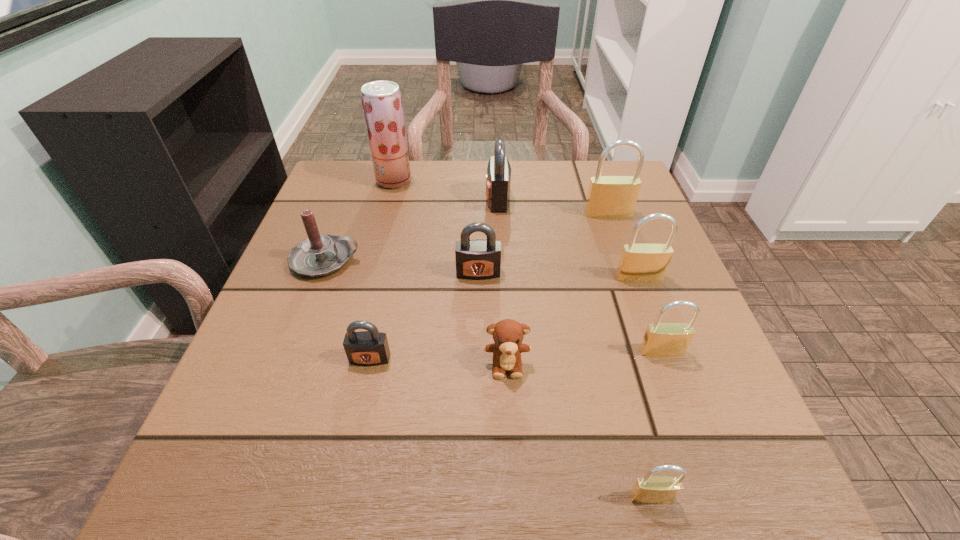
The image size is (960, 540). Identify the location of vacant area situated 0.120m on the side of the candle with the handle loop. (420, 260).

Where is `vacant area located 0.390m on the front of the second smallest gray padlock near the keyhole`? The width and height of the screenshot is (960, 540). vacant area located 0.390m on the front of the second smallest gray padlock near the keyhole is located at coordinates (477, 495).

You are a GUI agent. You are given a task and a screenshot of the screen. Output one action in this format:
    pyautogui.click(x=<x>, y=<y>)
    Task: Click on the blank space located 0.150m on the front-facing side of the second nearest brass padlock
    This screenshot has height=540, width=960.
    Given the screenshot: What is the action you would take?
    pyautogui.click(x=696, y=447)

Where is `vacant space located on the face of the teddy bear`? This screenshot has width=960, height=540. vacant space located on the face of the teddy bear is located at coordinates (512, 464).

You are a GUI agent. You are given a task and a screenshot of the screen. Output one action in this format:
    pyautogui.click(x=<x>, y=<y>)
    Task: Click on the vacant area located on the front of the leftmost gray padlock near the keyhole
    This screenshot has width=960, height=540.
    Given the screenshot: What is the action you would take?
    pyautogui.click(x=348, y=461)

The height and width of the screenshot is (540, 960). Find the location of `fruit juice present at the far edge`. fruit juice present at the far edge is located at coordinates pyautogui.click(x=382, y=103).

Where is `object that is positioned at the near edge`? object that is positioned at the near edge is located at coordinates (649, 489).

At what (x,y) coordinates should I click in order to perform the action: click on fruit juice located in the left edge section of the desktop. Please return your answer as a coordinate pair (x, y). This screenshot has width=960, height=540. Looking at the image, I should click on (382, 103).

Where is `candle at the left edge`? candle at the left edge is located at coordinates (318, 255).

This screenshot has width=960, height=540. What are the coordinates of `object present at the far left corner` in the screenshot? It's located at (382, 103).